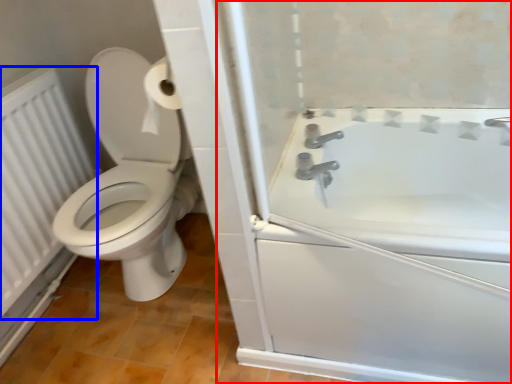
Question: Which of the following is the farthest to the observer, screen door (highlighted by a red box) or radiator (highlighted by a blue box)?

Choices:
 (A) screen door
 (B) radiator

Answer: (B)